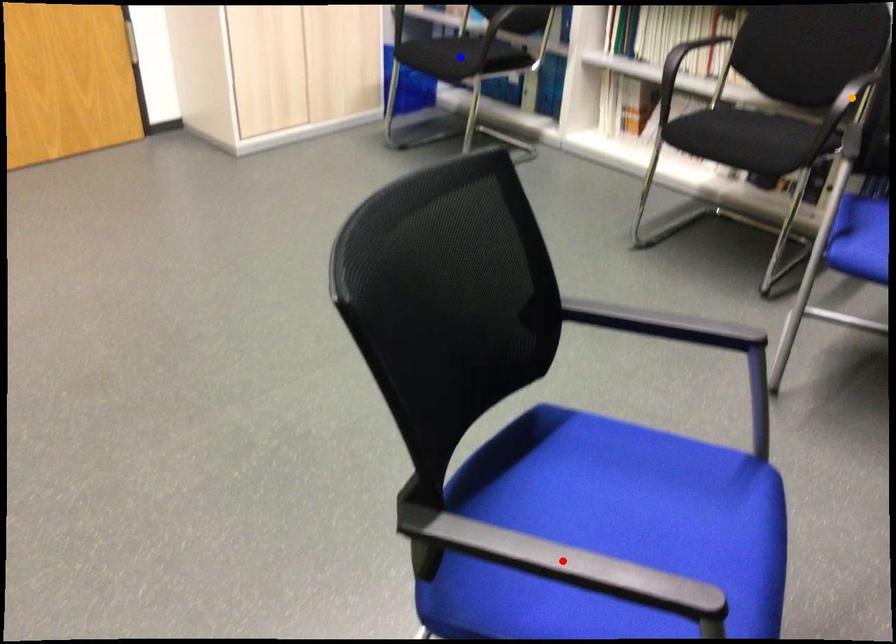
Order these from nearest to farthest:
blue point, orange point, red point

red point
orange point
blue point